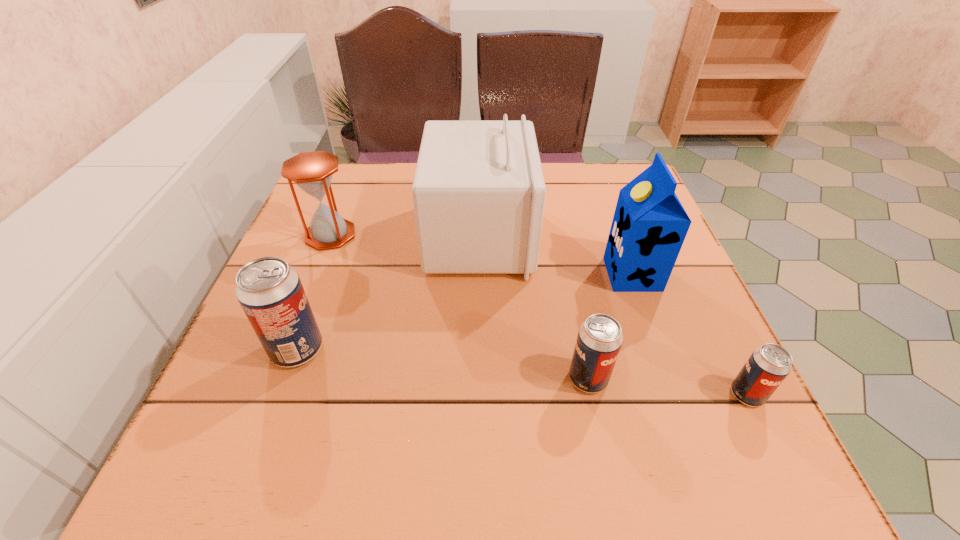
The image size is (960, 540). In order to click on vacant position for inserting another beer_can evenly in this screenshot , I will do `click(439, 363)`.